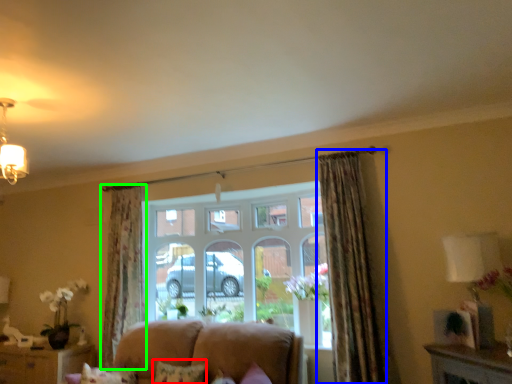
Question: Estimate the real-world distances between objects in this image. Which object is closer to pillow (highlighted by a red box), curtain (highlighted by a blue box) or curtain (highlighted by a green box)?

Choices:
 (A) curtain
 (B) curtain

Answer: (A)